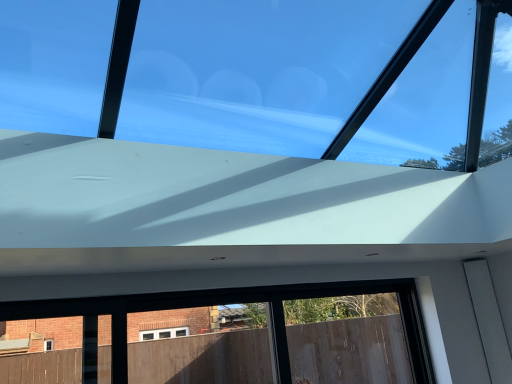
Question: Should I look upward or downward to see transparent glass window at upper center?

Choices:
 (A) up
 (B) down

Answer: (A)